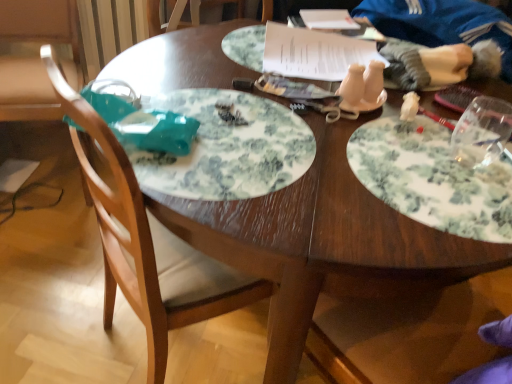
Identify the location of empty space that is ontop of white floral plate at right, the first plate when ordered from right to left. (438, 160).